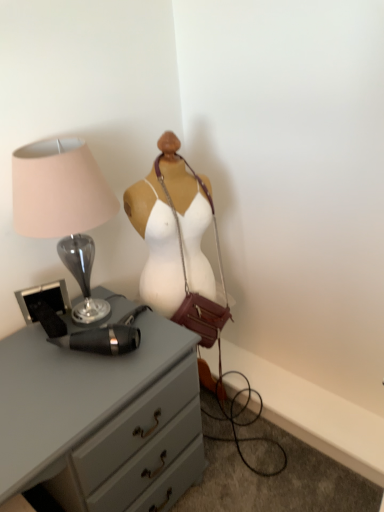
Question: In terms of width, does matte glass lamp at left look wider or thinner when compared to leather/maroon handbag at center?

Choices:
 (A) wide
 (B) thin

Answer: (A)

Question: In the image, is matte glass lamp at left on the left side or the right side of leather/maroon handbag at center?

Choices:
 (A) right
 (B) left

Answer: (B)

Question: Which is farther from the matte gray chest of drawers at center-left?

Choices:
 (A) leather/maroon handbag at center
 (B) matte glass lamp at left

Answer: (A)

Question: Which object is positioned closest to the leather/maroon handbag at center?

Choices:
 (A) matte gray chest of drawers at center-left
 (B) matte glass lamp at left

Answer: (B)